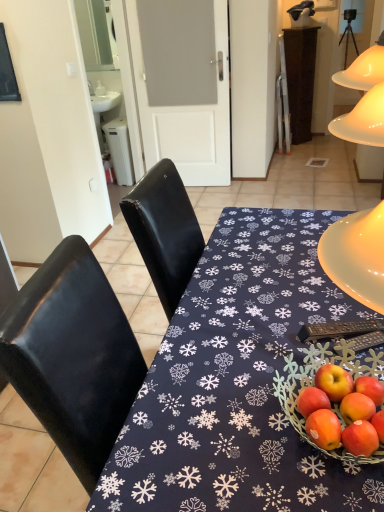
This screenshot has width=384, height=512. I want to click on free area behind black plastic remote control at lower right, so [x=306, y=292].